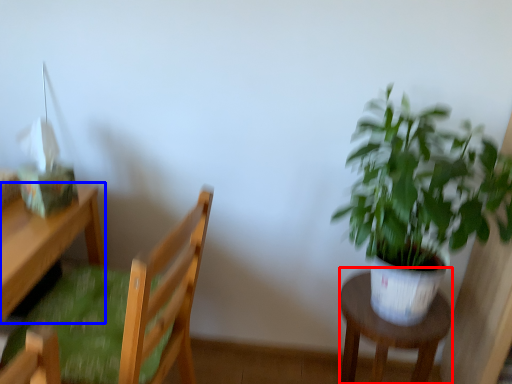
Question: Which of the following is the farthest to the observer, stool (highlighted by a red box) or desk (highlighted by a blue box)?

Choices:
 (A) stool
 (B) desk

Answer: (A)